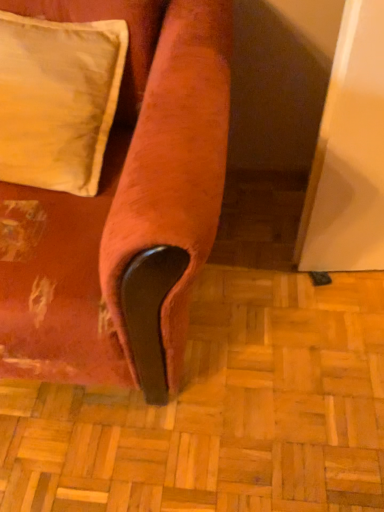
Question: Considering the relative sizes of velvet-like orange couch at lower left and satin cream pillow at upper left in the image provided, is velvet-like orange couch at lower left taller than satin cream pillow at upper left?

Choices:
 (A) yes
 (B) no

Answer: (A)

Question: Is velvet-like orange couch at lower left wider than satin cream pillow at upper left?

Choices:
 (A) yes
 (B) no

Answer: (A)

Question: From a real-world perspective, is velvet-like orange couch at lower left below satin cream pillow at upper left?

Choices:
 (A) no
 (B) yes

Answer: (B)

Question: Is velvet-like orange couch at lower left positioned before satin cream pillow at upper left?

Choices:
 (A) no
 (B) yes

Answer: (B)

Question: Would you consider velvet-like orange couch at lower left to be distant from satin cream pillow at upper left?

Choices:
 (A) yes
 (B) no

Answer: (B)

Question: Considering the relative positions of velvet-like orange couch at lower left and satin cream pillow at upper left in the image provided, is velvet-like orange couch at lower left to the left of satin cream pillow at upper left from the viewer's perspective?

Choices:
 (A) no
 (B) yes

Answer: (B)

Question: Can you confirm if satin cream pillow at upper left is bigger than velvet-like orange couch at lower left?

Choices:
 (A) yes
 (B) no

Answer: (B)

Question: Does satin cream pillow at upper left turn towards velvet-like orange couch at lower left?

Choices:
 (A) no
 (B) yes

Answer: (B)

Question: Is there a large distance between satin cream pillow at upper left and velvet-like orange couch at lower left?

Choices:
 (A) no
 (B) yes

Answer: (A)

Question: Is satin cream pillow at upper left positioned with its back to velvet-like orange couch at lower left?

Choices:
 (A) no
 (B) yes

Answer: (B)

Question: Are satin cream pillow at upper left and velvet-like orange couch at lower left making contact?

Choices:
 (A) no
 (B) yes

Answer: (A)

Question: Can you confirm if satin cream pillow at upper left is wider than velvet-like orange couch at lower left?

Choices:
 (A) yes
 (B) no

Answer: (B)

Question: From the image's perspective, is velvet-like orange couch at lower left located above or below satin cream pillow at upper left?

Choices:
 (A) below
 (B) above

Answer: (A)